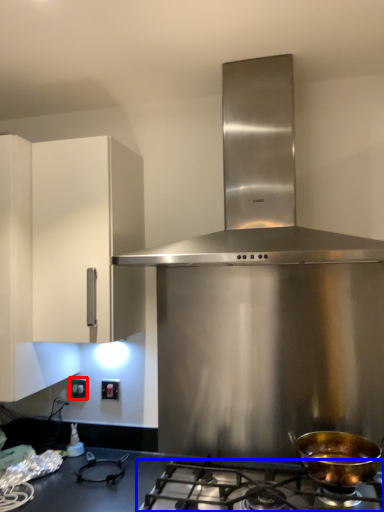
Question: Which of the following is the closest to the observer, electric outlet (highlighted by a red box) or gas stove (highlighted by a blue box)?

Choices:
 (A) electric outlet
 (B) gas stove

Answer: (B)